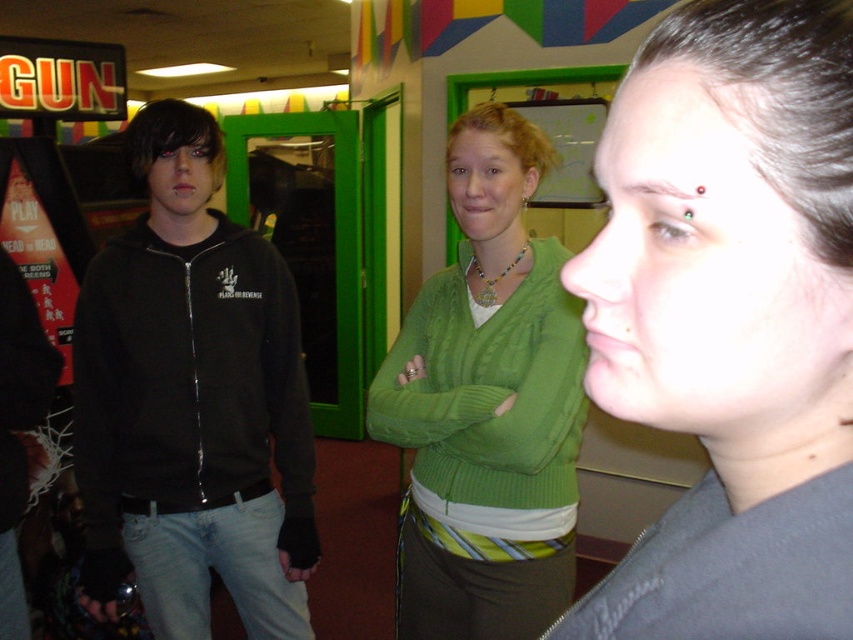
You are standing in the arcade and see the matte black forehead at upper center. If you want to locate it precisely, what are its coordinates?

The coordinates of the matte black forehead at upper center are at point (730, 320).